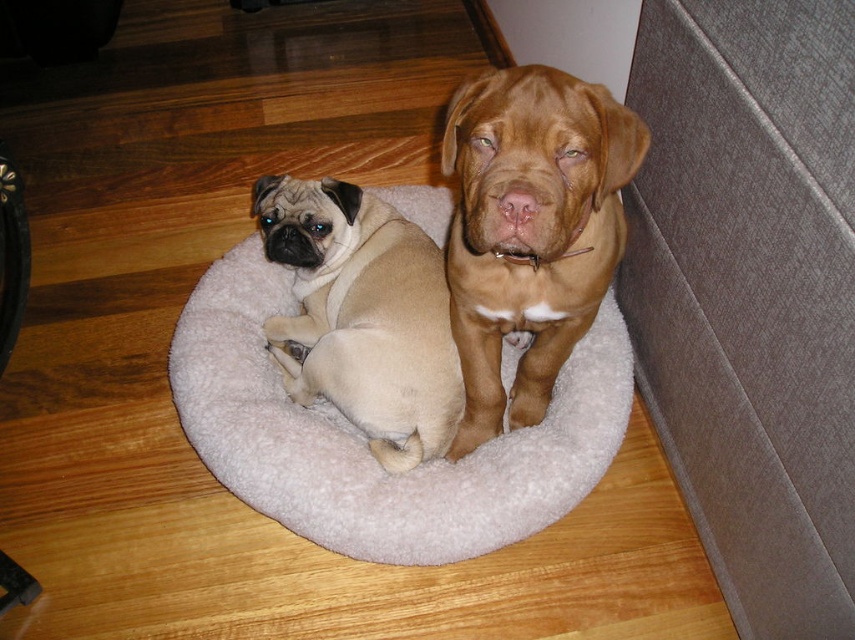
Question: Which object is positioned closest to the white fluffy dog bed at center?

Choices:
 (A) beige fur pug at center
 (B) brown smooth dog at center

Answer: (A)

Question: Among these objects, which one is nearest to the camera?

Choices:
 (A) white fluffy dog bed at center
 (B) brown smooth dog at center
 (C) beige fur pug at center

Answer: (B)

Question: Considering the relative positions of white fluffy dog bed at center and beige fur pug at center in the image provided, where is white fluffy dog bed at center located with respect to beige fur pug at center?

Choices:
 (A) below
 (B) above

Answer: (A)

Question: Is white fluffy dog bed at center positioned in front of brown smooth dog at center?

Choices:
 (A) yes
 (B) no

Answer: (B)

Question: Does brown smooth dog at center have a smaller size compared to beige fur pug at center?

Choices:
 (A) yes
 (B) no

Answer: (B)

Question: Which object is positioned farthest from the brown smooth dog at center?

Choices:
 (A) beige fur pug at center
 (B) white fluffy dog bed at center

Answer: (B)